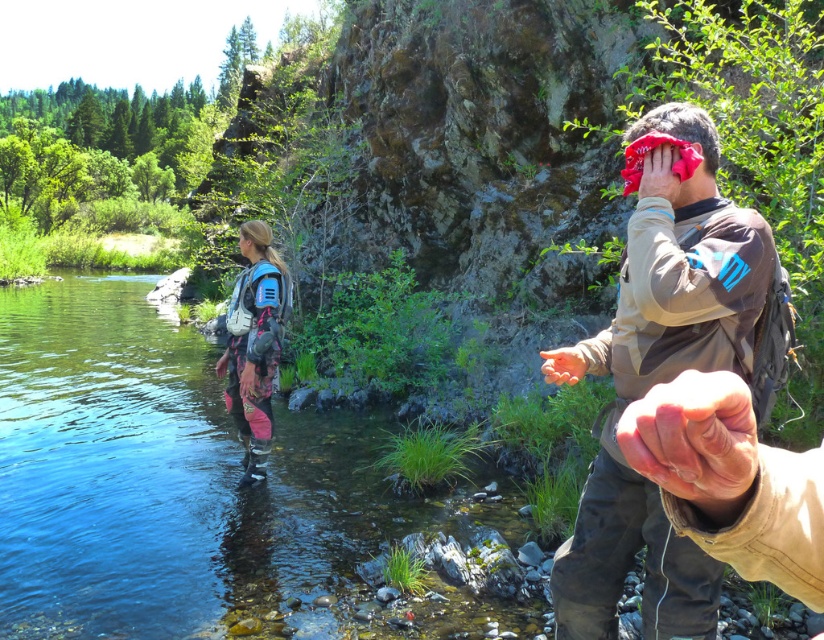
Question: Is clear blue water at center above dry skin at center?

Choices:
 (A) yes
 (B) no

Answer: (B)

Question: Which of the following is the farthest from the observer?

Choices:
 (A) (x=260, y=426)
 (B) (x=10, y=636)

Answer: (A)

Question: Observing the image, what is the correct spatial positioning of brown matte jacket at center in reference to pink fabric backpack at center-left?

Choices:
 (A) below
 (B) above

Answer: (B)

Question: Is dry skin at center closer to camera compared to matte brown hand at center?

Choices:
 (A) yes
 (B) no

Answer: (A)

Question: Based on their relative distances, which object is farther from the dry skin at center?

Choices:
 (A) clear blue water at center
 (B) pink fabric backpack at center-left
 (C) brown matte jacket at center

Answer: (A)

Question: Which object is closer to the camera taking this photo?

Choices:
 (A) matte brown hand at center
 (B) brown matte jacket at center

Answer: (B)